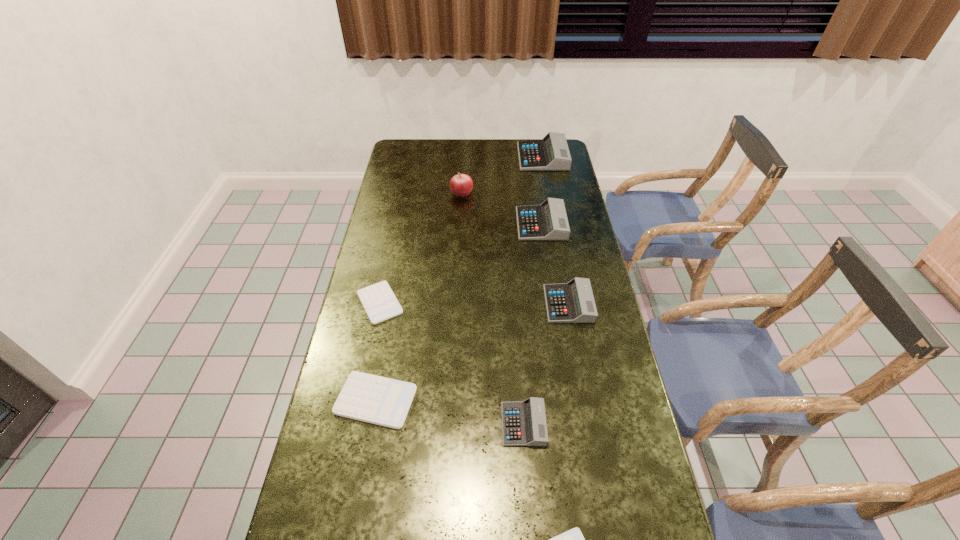
The width and height of the screenshot is (960, 540). Identify the location of free space located on the right of the farthest white calculator. (495, 303).

In order to click on object present at the far edge in this screenshot , I will do `click(551, 153)`.

I want to click on object at the far right corner, so tap(551, 153).

You are a GUI agent. You are given a task and a screenshot of the screen. Output one action in this format:
    pyautogui.click(x=<x>, y=<y>)
    Task: Click on the vacant area at the far edge of the desktop
    The width and height of the screenshot is (960, 540).
    Given the screenshot: What is the action you would take?
    pyautogui.click(x=502, y=159)

In the image, there is a desktop. Where is `vacant space at the left edge`? The width and height of the screenshot is (960, 540). vacant space at the left edge is located at coordinates (378, 215).

The image size is (960, 540). In the image, there is a desktop. What are the coordinates of `free space at the right edge` in the screenshot? It's located at (600, 440).

This screenshot has height=540, width=960. In order to click on vacant position at the far left corner of the desktop in this screenshot , I will do `click(405, 160)`.

Image resolution: width=960 pixels, height=540 pixels. I want to click on free space between the sixth object from right to left and the biggest gray calculator, so click(502, 174).

The image size is (960, 540). In order to click on vacant region between the second farthest object and the third tallest calculator in this screenshot , I will do `click(516, 248)`.

Locate an element on the screen. The height and width of the screenshot is (540, 960). free spot between the biggest white calculator and the fourth tallest object is located at coordinates (472, 352).